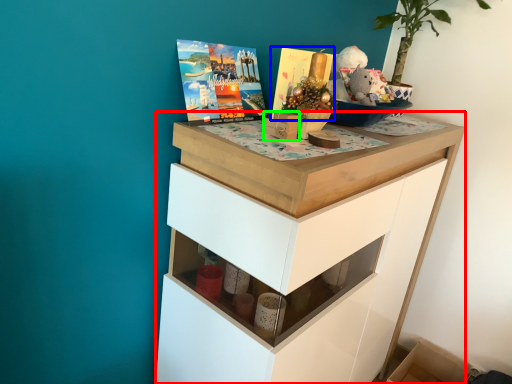
Question: Considering the real-world distances, which object is closest to chest of drawers (highlighted by a red box)? magazine (highlighted by a blue box) or box (highlighted by a green box).

Choices:
 (A) magazine
 (B) box

Answer: (B)